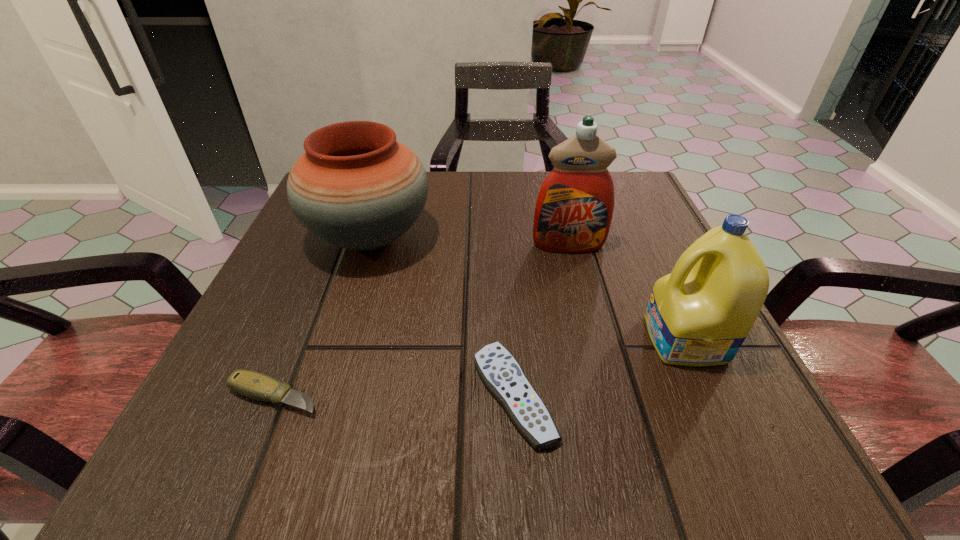
Where is `free spot at the far edge of the desktop`? The height and width of the screenshot is (540, 960). free spot at the far edge of the desktop is located at coordinates (516, 184).

At what (x,y) coordinates should I click in order to perform the action: click on free region at the near edge of the desktop. Please return your answer as a coordinate pair (x, y). Image resolution: width=960 pixels, height=540 pixels. Looking at the image, I should click on (561, 458).

In order to click on vacant space at the left edge of the desktop in this screenshot , I will do `click(304, 294)`.

The image size is (960, 540). I want to click on vacant space at the right edge of the desktop, so click(x=634, y=299).

Find the location of a particular element. free space that is in between the remote control and the pottery is located at coordinates (442, 316).

Identify the location of vacant area that lies between the right detergent and the shortest object. The image size is (960, 540). (600, 367).

This screenshot has height=540, width=960. I want to click on free space between the rightmost object and the shortest object, so click(600, 367).

You are a GUI agent. You are given a task and a screenshot of the screen. Output one action in this format:
    pyautogui.click(x=<x>, y=<y>)
    Task: Click on the free area in between the pottery and the pocketknife
    
    Given the screenshot: What is the action you would take?
    pyautogui.click(x=322, y=317)

This screenshot has height=540, width=960. What are the coordinates of `empty location between the farther detergent and the pocketknife` in the screenshot? It's located at (421, 321).

Where is `free space between the pottery and the pocketknife`? This screenshot has width=960, height=540. free space between the pottery and the pocketknife is located at coordinates (322, 317).